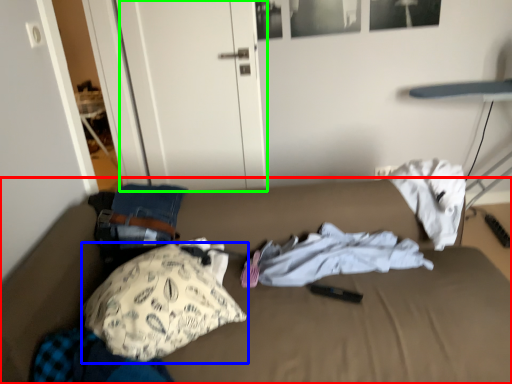
Question: Which object is the farthest from bed (highlighted by a red box)? Choose among these: pillow (highlighted by a blue box) or door (highlighted by a green box).

Choices:
 (A) pillow
 (B) door

Answer: (B)